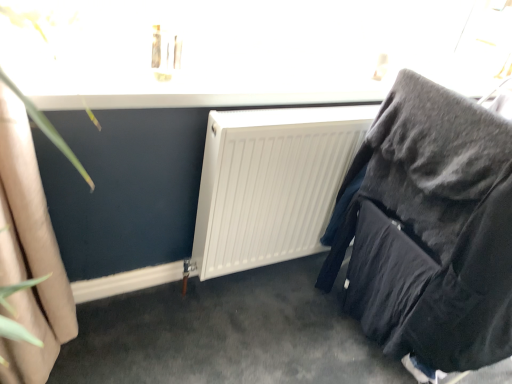
Question: Is point tap(507, 261) closer or farther from the camera than point tap(311, 165)?

Choices:
 (A) closer
 (B) farther

Answer: (A)

Question: Is velvet black chair at right to the left or to the right of white plastic radiator at center in the image?

Choices:
 (A) right
 (B) left

Answer: (A)

Question: Based on their sizes in the image, would you say velvet black chair at right is bigger or smaller than white plastic radiator at center?

Choices:
 (A) small
 (B) big

Answer: (B)

Question: From a real-world perspective, relative to velvet black chair at right, is white plastic radiator at center vertically above or below?

Choices:
 (A) above
 (B) below

Answer: (B)

Question: Is point (209, 269) closer or farther from the camera than point (377, 278)?

Choices:
 (A) closer
 (B) farther

Answer: (B)

Question: From their relative heights in the image, would you say white plastic radiator at center is taller or shorter than velvet black chair at right?

Choices:
 (A) tall
 (B) short

Answer: (B)

Question: From the image's perspective, is white plastic radiator at center positioned above or below velvet black chair at right?

Choices:
 (A) above
 (B) below

Answer: (A)